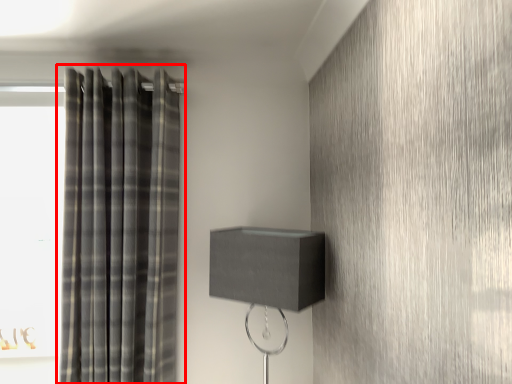
Question: Considering the relative positions of curtain (annotated by the red box) and table lamp in the image provided, where is curtain (annotated by the red box) located with respect to the staircase?

Choices:
 (A) left
 (B) right

Answer: (A)